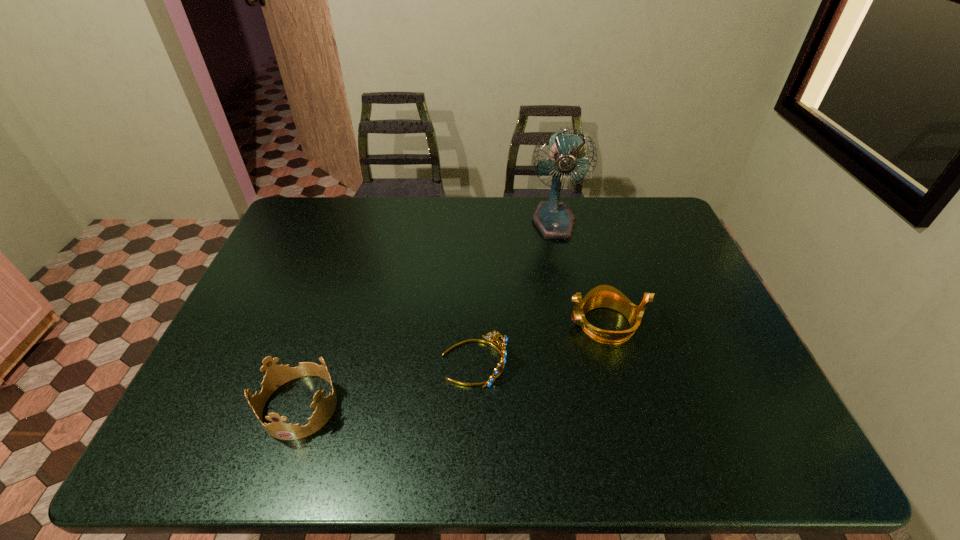
Where is `tiara that stands as the second closest to the rightmost tiara`? This screenshot has height=540, width=960. tiara that stands as the second closest to the rightmost tiara is located at coordinates (276, 375).

This screenshot has width=960, height=540. Identify the location of free region that satisfies the following two spatial constraints: 1. at the front emblem of the rightmost tiara; 2. on the front-facing side of the leftmost object. (627, 406).

The height and width of the screenshot is (540, 960). I want to click on vacant space that satisfies the following two spatial constraints: 1. at the front emblem of the rightmost tiara; 2. on the front-facing side of the leftmost tiara, so click(627, 406).

Locate an element on the screen. The width and height of the screenshot is (960, 540). blank space that satisfies the following two spatial constraints: 1. on the front-facing side of the third object from right to left; 2. on the front-facing side of the leftmost tiara is located at coordinates pos(473,406).

The width and height of the screenshot is (960, 540). Find the location of `vacant space that satisfies the following two spatial constraints: 1. on the front-facing side of the second object from left to right; 2. on the front-facing side of the leftmost object`. vacant space that satisfies the following two spatial constraints: 1. on the front-facing side of the second object from left to right; 2. on the front-facing side of the leftmost object is located at coordinates (473, 406).

You are a GUI agent. You are given a task and a screenshot of the screen. Output one action in this format:
    pyautogui.click(x=<x>, y=<y>)
    Task: Click on the vacant region that satisfies the following two spatial constraints: 1. in front of the fan where the wind blows; 2. on the front-facing side of the second tiara from right to left
    
    Given the screenshot: What is the action you would take?
    pyautogui.click(x=583, y=362)